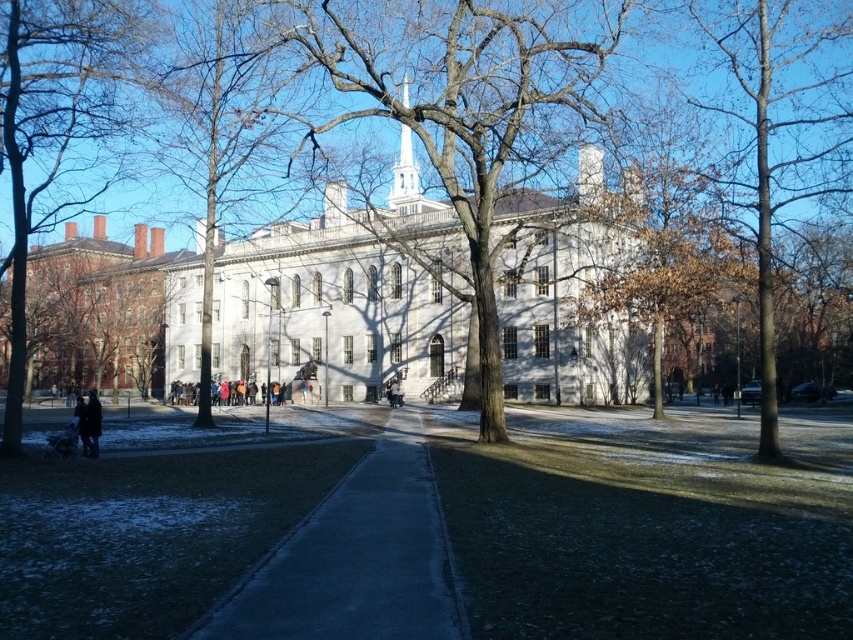
Is bare wood tree at center to the right of dark blue jacket at lower left from the viewer's perspective?

Yes, bare wood tree at center is to the right of dark blue jacket at lower left.

Does bare wood tree at center appear on the left side of dark blue jacket at lower left?

In fact, bare wood tree at center is to the right of dark blue jacket at lower left.

Find the location of a particular element. The width and height of the screenshot is (853, 640). bare wood tree at center is located at coordinates (460, 108).

Is bare wood tree at center in front of bare wood tree at left?

That is False.

Locate an element on the screen. bare wood tree at center is located at coordinates (460, 108).

Locate an element on the screen. bare wood tree at center is located at coordinates (460, 108).

Does brown wood tree at right have a greater height compared to dark blue jacket at lower left?

Indeed, brown wood tree at right has a greater height compared to dark blue jacket at lower left.

I want to click on brown wood tree at right, so click(782, 129).

Which is behind, point (693, 104) or point (91, 445)?

The point (693, 104) is behind.

At what (x,y) coordinates should I click in order to perform the action: click on brown wood tree at right. Please return your answer as a coordinate pair (x, y). This screenshot has width=853, height=640. Looking at the image, I should click on (782, 129).